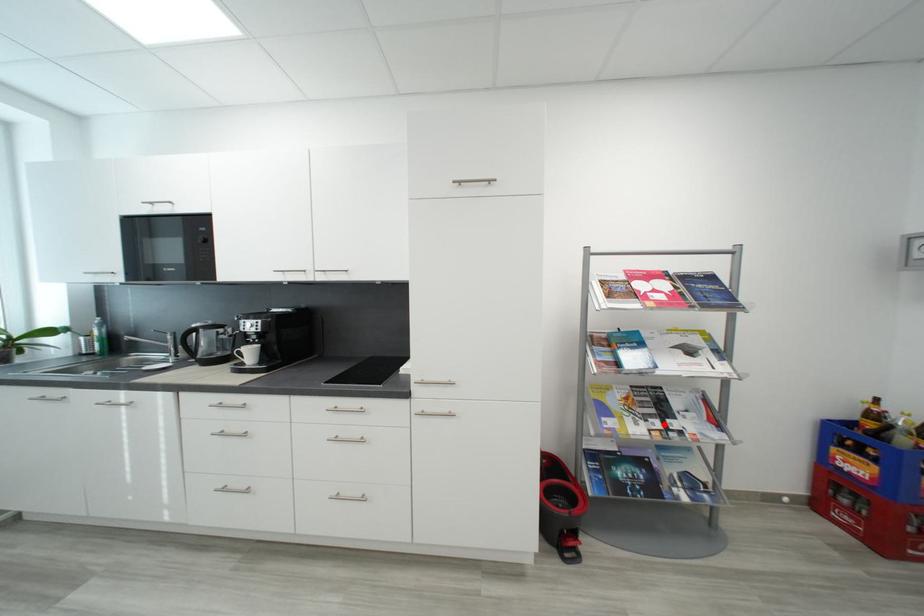
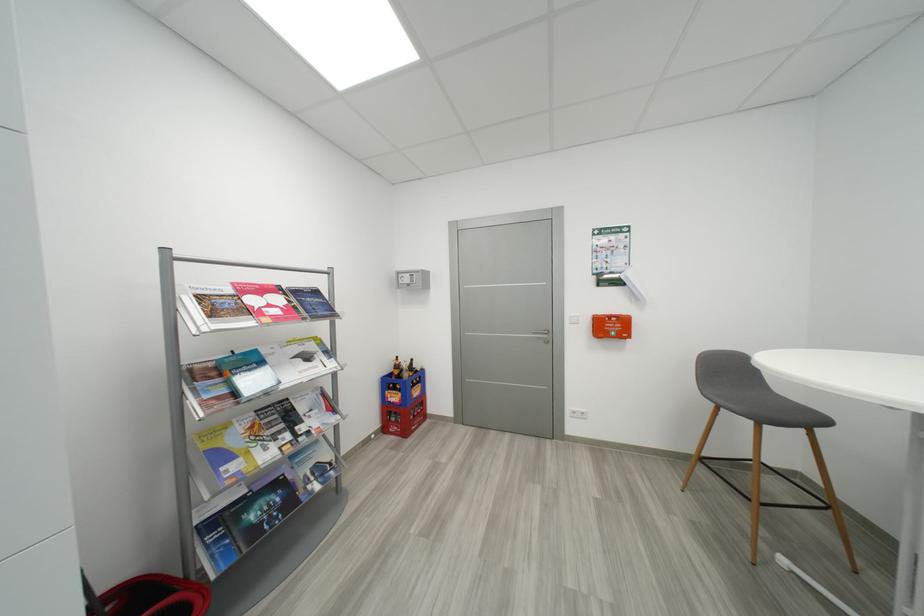
Locate, in the second image, the point that corresponds to the highlighted location in the first image.

(294, 438)